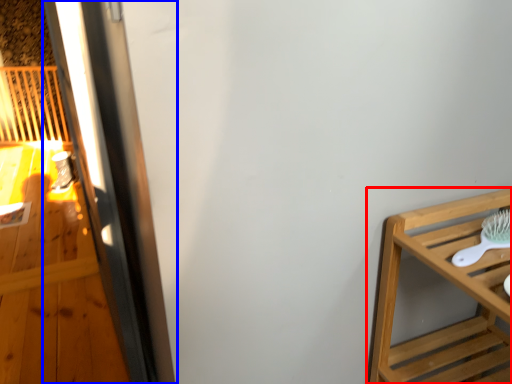
Question: Which object appears farthest to the camera in this image, furniture (highlighted by a red box) or screen door (highlighted by a blue box)?

Choices:
 (A) furniture
 (B) screen door

Answer: (B)